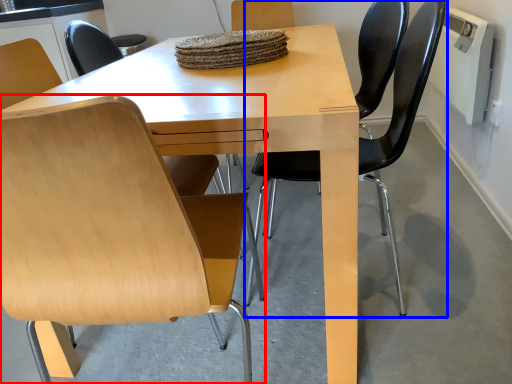
Question: Among these objects, which one is nearest to the camera, chair (highlighted by a red box) or chair (highlighted by a blue box)?

Choices:
 (A) chair
 (B) chair

Answer: (A)